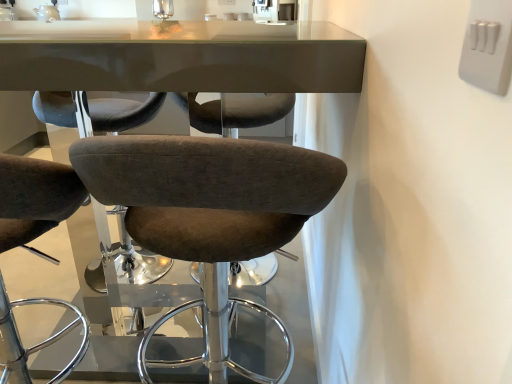
Question: Is point (276, 19) closer or farther from the camera than point (133, 178)?

Choices:
 (A) closer
 (B) farther

Answer: (B)

Question: In terms of width, does white glossy sink at upper center look wider or thinner when compared to brown fabric stool at center?

Choices:
 (A) wide
 (B) thin

Answer: (B)

Question: Which object is positioned closest to the white glossy sink at upper center?

Choices:
 (A) brown fabric stool at center
 (B) white plastic switch at upper right

Answer: (A)

Question: Estimate the real-world distances between objects in this image. Which object is farther from the white plastic switch at upper right?

Choices:
 (A) white glossy sink at upper center
 (B) brown fabric stool at center

Answer: (A)